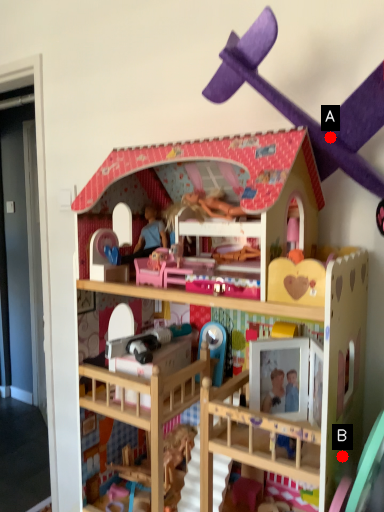
Question: Two points are circled on the image, labeled by A and B beside each circle. Which of the following is the farthest from the observer?

Choices:
 (A) A is further
 (B) B is further

Answer: (B)